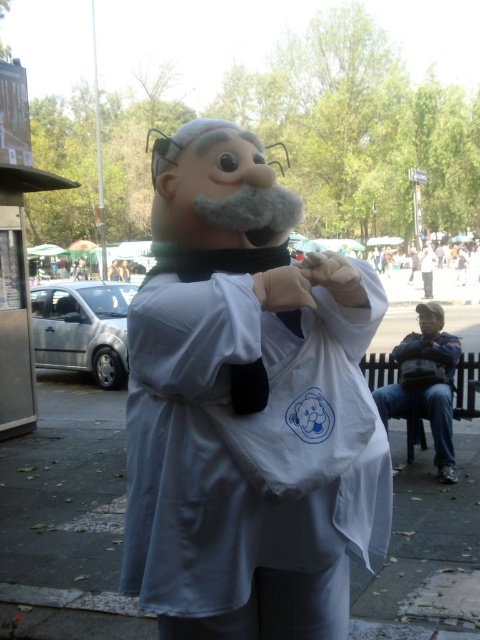
Describe the element at coordinates (248, 406) in the screenshot. I see `white matte bag at center` at that location.

Consider the image. Can you confirm if white matte bag at center is taller than dark blue jeans at lower right?

No, white matte bag at center is not taller than dark blue jeans at lower right.

Locate an element on the screen. white matte bag at center is located at coordinates (248, 406).